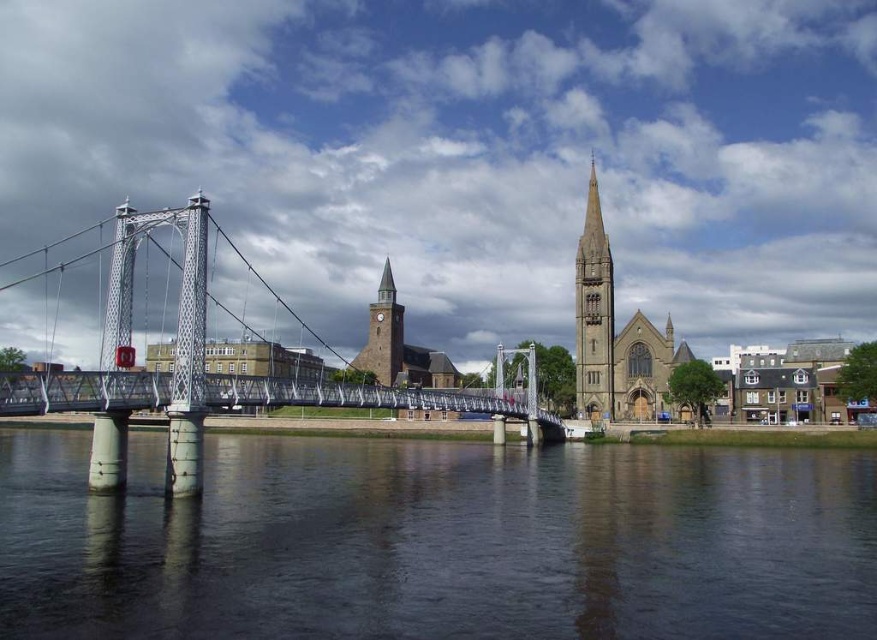
The height and width of the screenshot is (640, 877). I want to click on metallic suspension bridge at left, so click(x=203, y=372).

Does metallic suspension bridge at left have a greater height compared to brown stone church at center?

Incorrect, metallic suspension bridge at left's height is not larger of brown stone church at center's.

Locate an element on the screen. The width and height of the screenshot is (877, 640). metallic suspension bridge at left is located at coordinates (203, 372).

Who is taller, dark water at center or gray stone spire at center?

gray stone spire at center is taller.

Which is in front, point (108, 531) or point (578, 342)?

Positioned in front is point (108, 531).

Image resolution: width=877 pixels, height=640 pixels. What are the coordinates of `dark water at center` in the screenshot? It's located at (438, 541).

Is brown stone church at center smaller than brown stone clock tower at center?

No.

Does brown stone church at center lie in front of brown stone clock tower at center?

Yes.

Describe the element at coordinates (617, 339) in the screenshot. I see `brown stone church at center` at that location.

Locate an element on the screen. The image size is (877, 640). brown stone church at center is located at coordinates (617, 339).